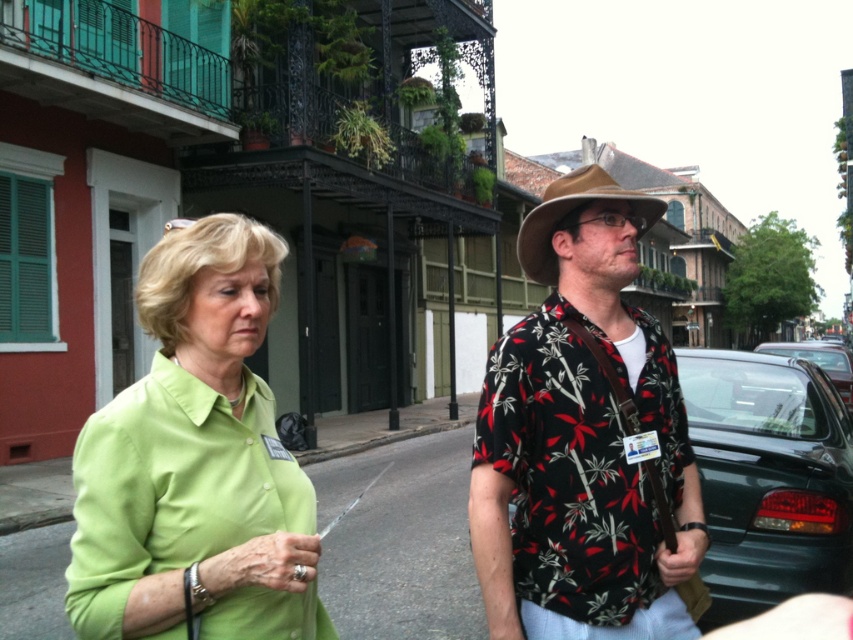
Can you confirm if floral-patterned shirt at center is positioned to the left of green matte car at right?

Indeed, floral-patterned shirt at center is positioned on the left side of green matte car at right.

Where is `floral-patterned shirt at center`? This screenshot has width=853, height=640. floral-patterned shirt at center is located at coordinates (584, 438).

Is point (577, 211) positioned behind point (753, 372)?

That is False.

Where is `floral-patterned shirt at center`? The height and width of the screenshot is (640, 853). floral-patterned shirt at center is located at coordinates (584, 438).

Who is higher up, green matte car at right or metallic silver car at right?

Positioned higher is green matte car at right.

Based on the photo, does green matte car at right have a lesser width compared to metallic silver car at right?

Indeed, green matte car at right has a lesser width compared to metallic silver car at right.

Where is `green matte car at right`? green matte car at right is located at coordinates (769, 477).

At what (x,y) coordinates should I click in order to perform the action: click on green matte car at right. Please return your answer as a coordinate pair (x, y). The height and width of the screenshot is (640, 853). Looking at the image, I should click on (769, 477).

Which is below, green matte car at right or brown felt fedora at center?

Positioned lower is green matte car at right.

Is point (718, 484) closer to viewer compared to point (524, 262)?

No, it is not.

Where is `green matte car at right`? Image resolution: width=853 pixels, height=640 pixels. green matte car at right is located at coordinates (769, 477).